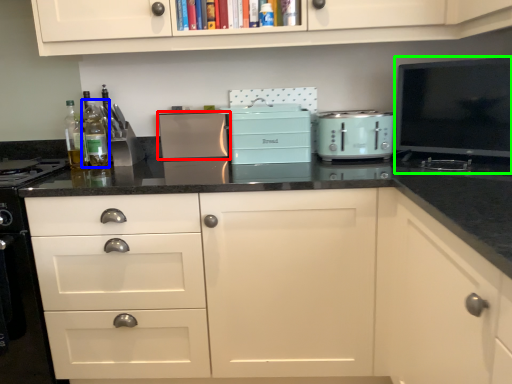
Question: Which object is positioned closest to kitchen appliance (highlighted by a red box)? Select from bottle (highlighted by a blue box) and appliance (highlighted by a green box).

Choices:
 (A) bottle
 (B) appliance

Answer: (A)